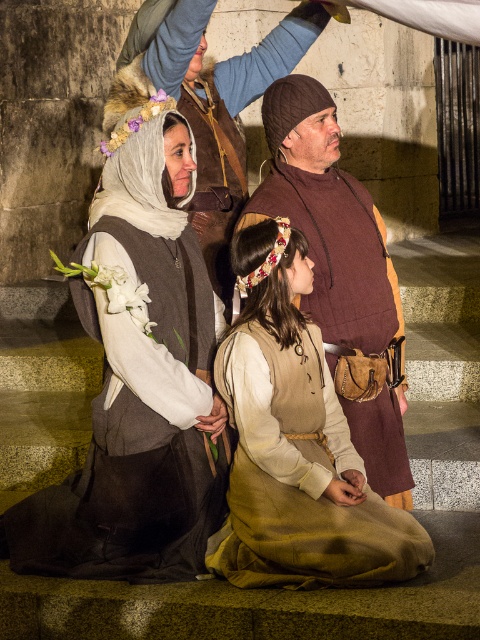
You are a costume designer observing the medieval scene. You need to determine which item takes up more horizontal space in the image. Which is wider between the brown leather dress at center and the fluffy fur headband at upper left?

The brown leather dress at center is wider than the fluffy fur headband at upper left according to the description.

From the picture: What is the position of the point at coordinates (296, 442) in relation to the brown leather dress at center?

The point at coordinates (296, 442) is located on the brown leather dress at center.

In the scene shown: You are a photographer at the event and want to capture a clear shot of the brown leather vest at center and the fluffy fur headdress at upper left. Which object is closer to the camera?

The brown leather vest at center is closer to the camera because the fluffy fur headdress at upper left is behind it.